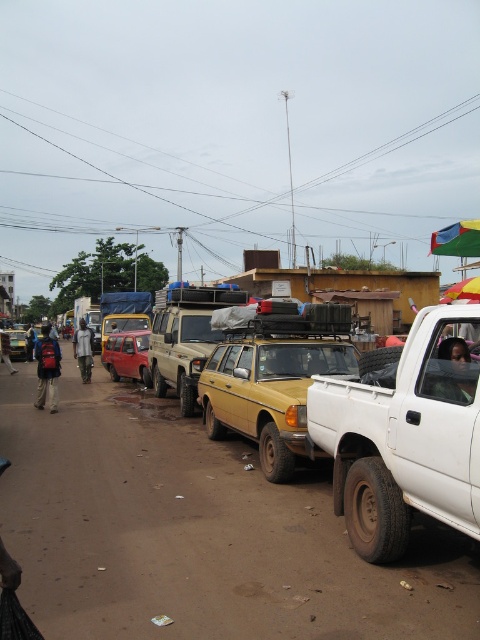
Question: In this image, where is red backpack at left located relative to dark blue shirt at center?

Choices:
 (A) right
 (B) left

Answer: (A)

Question: Does red backpack at left have a greater width compared to dark blue shirt at center?

Choices:
 (A) yes
 (B) no

Answer: (A)

Question: Among these objects, which one is nearest to the camera?

Choices:
 (A) matte black car at left
 (B) matte beige suv at center

Answer: (B)

Question: Considering the real-world distances, which object is farthest from the red backpack at left?

Choices:
 (A) matte beige suv at center
 (B) matte black car at left
 (C) metallic red van at center
 (D) dark blue shirt at center

Answer: (B)

Question: Estimate the real-world distances between objects in this image. Which object is farther from the metallic red van at center?

Choices:
 (A) white matte pickup truck at center
 (B) blue fabric bag at left
 (C) matte beige suv at center

Answer: (B)

Question: Does red backpack at left appear under matte black car at left?

Choices:
 (A) yes
 (B) no

Answer: (A)